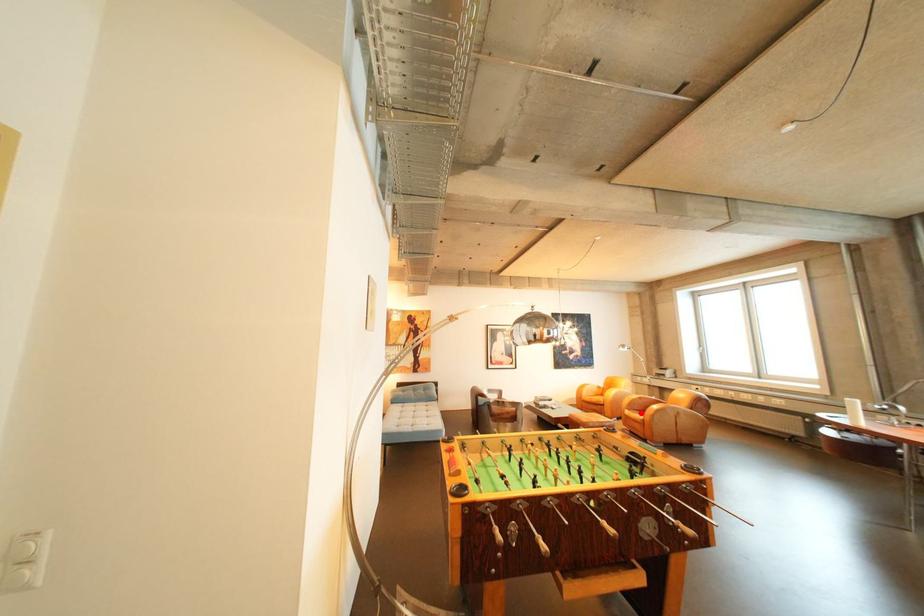
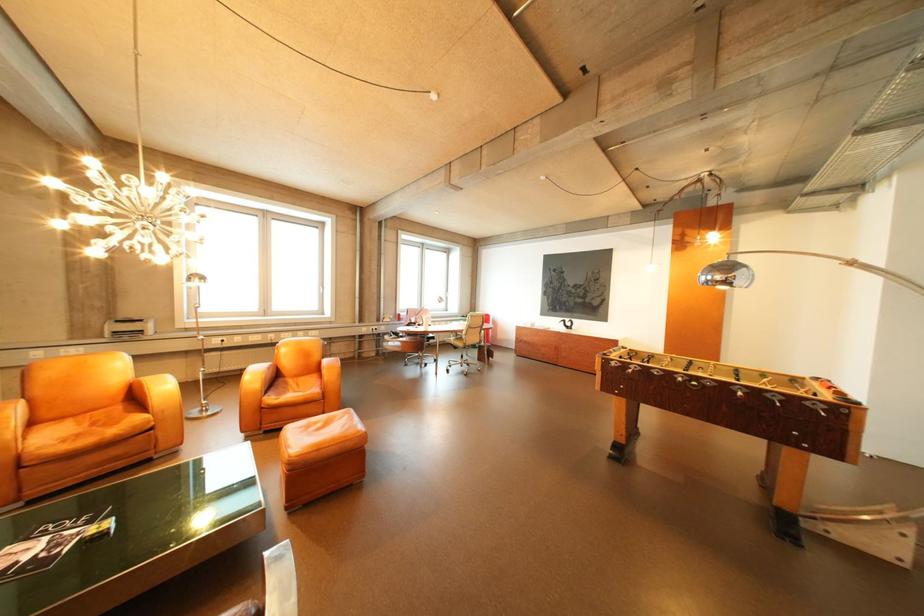
Question: I am providing you with two images of the same scene from different viewpoints. Image1 has a red point marked. In image2, the corresponding 3D location appears at what relative position? Reply with the corresponding letter.

Choices:
 (A) Closer
 (B) Farther

Answer: (A)